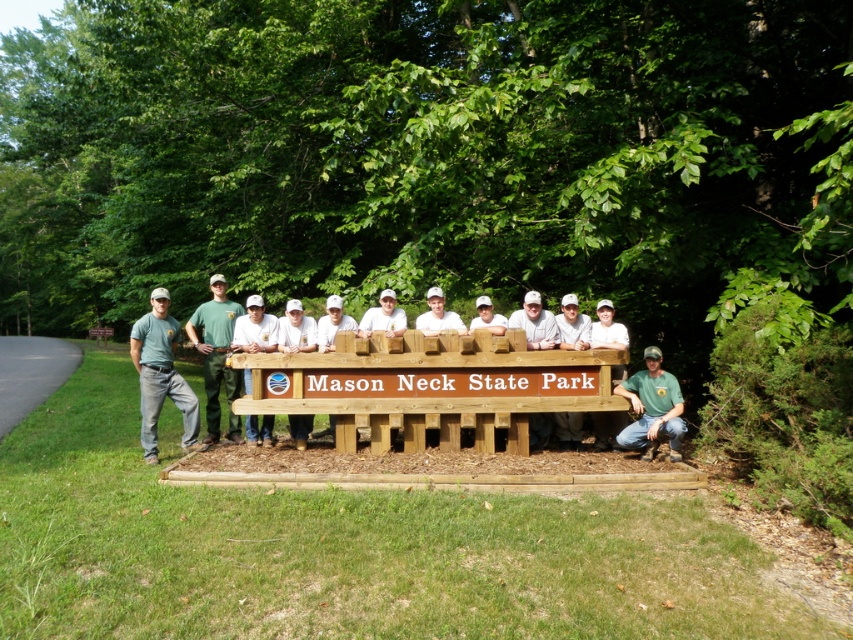
Can you confirm if matte green shirt at left is thinner than green uniform at center?

Indeed, matte green shirt at left has a lesser width compared to green uniform at center.

Find the location of a particular element. matte green shirt at left is located at coordinates click(161, 376).

Can you confirm if green uniform at center is positioned below green fabric shirt at lower right?

Actually, green uniform at center is above green fabric shirt at lower right.

This screenshot has width=853, height=640. Find the location of `green uniform at center`. green uniform at center is located at coordinates (216, 355).

Where is `green uniform at center`? green uniform at center is located at coordinates [216, 355].

Can you confirm if matte green shirt at left is smaller than green fabric shirt at lower right?

Correct, matte green shirt at left occupies less space than green fabric shirt at lower right.

From the picture: Does matte green shirt at left have a larger size compared to green fabric shirt at lower right?

No, matte green shirt at left is not bigger than green fabric shirt at lower right.

Locate an element on the screen. Image resolution: width=853 pixels, height=640 pixels. matte green shirt at left is located at coordinates (161, 376).

Locate an element on the screen. Image resolution: width=853 pixels, height=640 pixels. matte green shirt at left is located at coordinates (161, 376).